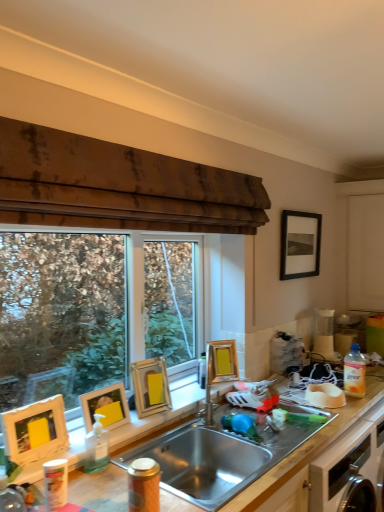
Find the location of a particular element. free location to the left of white matte bowl at right is located at coordinates (297, 401).